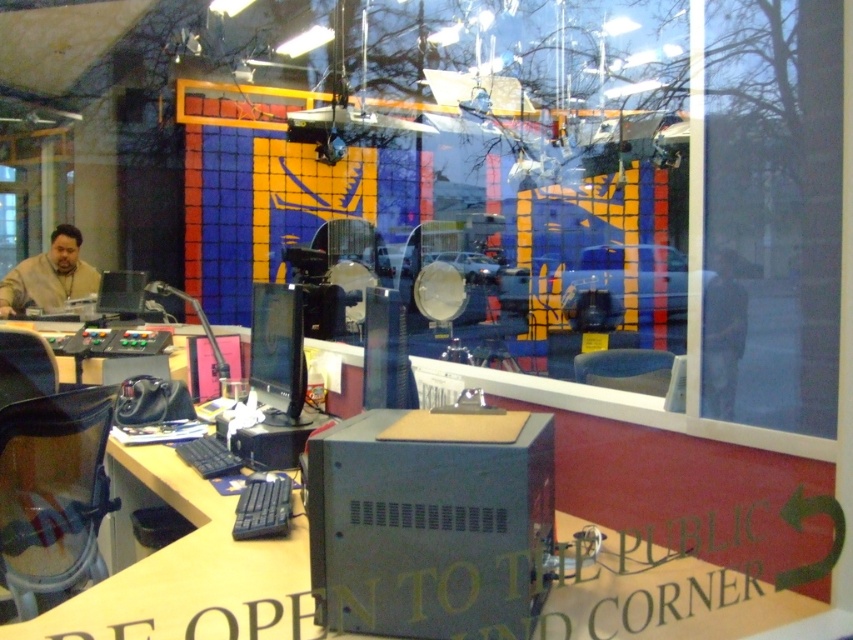
Question: Which point is farther from the camera taking this photo?

Choices:
 (A) (24, 292)
 (B) (200, 456)
 (C) (279, 481)
 (D) (706, 292)

Answer: (A)

Question: Considering the real-world distances, which object is closest to the metallic gray desk at center?

Choices:
 (A) matte brown shirt at left
 (B) black plastic keyboard at center

Answer: (B)

Question: Among these objects, which one is nearest to the camera?

Choices:
 (A) blue plastic keyboard at lower left
 (B) metallic gray desk at center
 (C) black plastic keyboard at center
 (D) matte brown shirt at left

Answer: (B)

Question: Is metallic gray desk at center to the left of matte brown shirt at left from the viewer's perspective?

Choices:
 (A) no
 (B) yes

Answer: (A)

Question: Can you confirm if matte brown shirt at left is positioned below black plastic keyboard at center?

Choices:
 (A) no
 (B) yes

Answer: (A)

Question: Is matte brown shirt at left further to camera compared to black plastic keyboard at center?

Choices:
 (A) yes
 (B) no

Answer: (A)